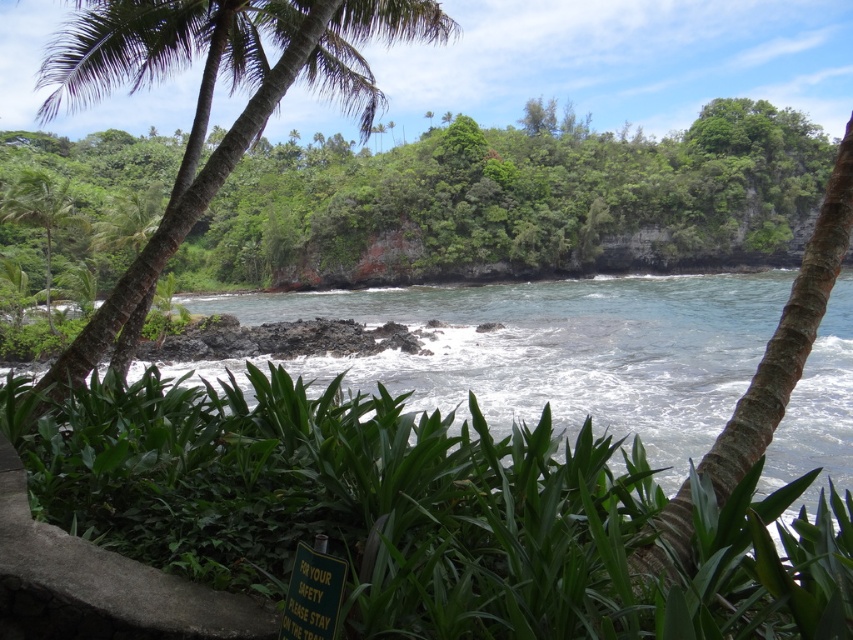
Looking at this image, does green textured palm tree at left appear over green leafy palm tree at left?

No, green textured palm tree at left is not above green leafy palm tree at left.

Does green textured palm tree at left have a greater width compared to green leafy palm tree at left?

No, green textured palm tree at left is not wider than green leafy palm tree at left.

What do you see at coordinates (257, 138) in the screenshot? This screenshot has width=853, height=640. I see `green textured palm tree at left` at bounding box center [257, 138].

Identify the location of green textured palm tree at left. This screenshot has height=640, width=853. (257, 138).

Does point (764, 280) lie in front of point (390, 40)?

That is False.

Find the location of a particular element. clear blue water at center is located at coordinates (560, 349).

Locate an element on the screen. The height and width of the screenshot is (640, 853). clear blue water at center is located at coordinates (560, 349).

Where is `clear blue water at center`? clear blue water at center is located at coordinates (560, 349).